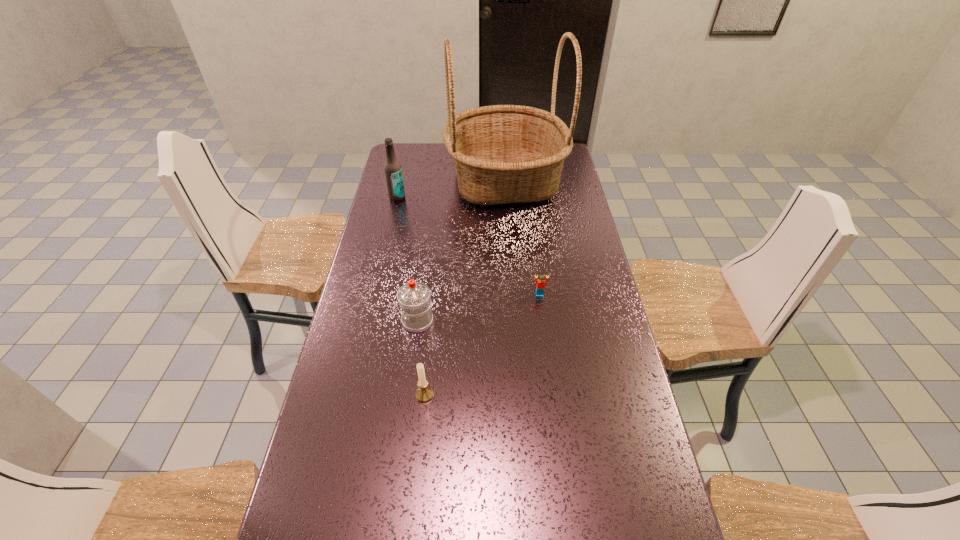
Find the location of a particular element. free point at the far edge is located at coordinates (449, 162).

Identify the location of vacant space at the left edge. The height and width of the screenshot is (540, 960). (309, 488).

I want to click on vacant position at the right edge of the desktop, so click(592, 347).

This screenshot has height=540, width=960. In the image, there is a desktop. In order to click on free region at the far left corner in this screenshot , I will do 405,147.

Identify the location of free space between the fourth farthest object and the beer bottle. This screenshot has width=960, height=540. (407, 259).

Where is `vacant space in between the third farthest object and the third shortest object`? Image resolution: width=960 pixels, height=540 pixels. vacant space in between the third farthest object and the third shortest object is located at coordinates (478, 308).

Where is `free space that is in between the shortest object and the tallest object`? The width and height of the screenshot is (960, 540). free space that is in between the shortest object and the tallest object is located at coordinates (522, 238).

Identify the location of unoccupied position between the candle holder and the third tallest object. (421, 357).

Locate an element on the screen. The image size is (960, 540). free area in between the fourth farthest object and the basket is located at coordinates 462,251.

I want to click on free spot between the beer bottle and the shortest object, so click(468, 246).